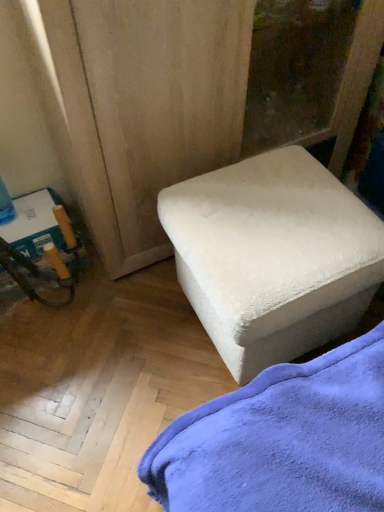
Locate an element on the screen. This screenshot has width=384, height=512. empty space that is ontop of white fabric ottoman at center is located at coordinates (278, 212).